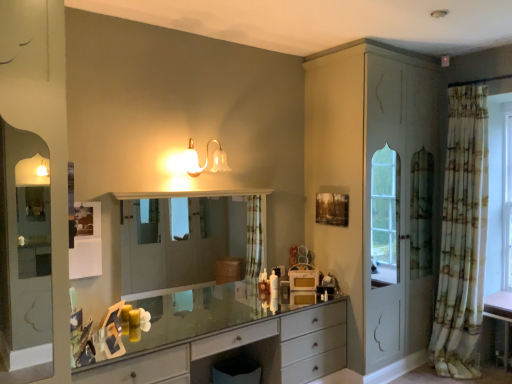
Question: Does printed fabric curtain at right come behind matte gray chest of drawers at center?

Choices:
 (A) no
 (B) yes

Answer: (B)

Question: From a real-world perspective, is printed fabric curtain at right on matte gray chest of drawers at center?

Choices:
 (A) yes
 (B) no

Answer: (A)

Question: Is printed fabric curtain at right to the right of matte gray chest of drawers at center from the viewer's perspective?

Choices:
 (A) no
 (B) yes

Answer: (B)

Question: Could you tell me if printed fabric curtain at right is facing matte gray chest of drawers at center?

Choices:
 (A) yes
 (B) no

Answer: (B)

Question: Can you confirm if printed fabric curtain at right is thinner than matte gray chest of drawers at center?

Choices:
 (A) yes
 (B) no

Answer: (A)

Question: Looking at their shapes, would you say translucent glass sconce at upper center is wider or thinner than clear glass mirror at center?

Choices:
 (A) thin
 (B) wide

Answer: (B)

Question: In the image, is translucent glass sconce at upper center on the left side or the right side of clear glass mirror at center?

Choices:
 (A) right
 (B) left

Answer: (B)

Question: Is translucent glass sconce at upper center spatially inside clear glass mirror at center, or outside of it?

Choices:
 (A) inside
 (B) outside

Answer: (B)

Question: From the image's perspective, is translucent glass sconce at upper center positioned above or below clear glass mirror at center?

Choices:
 (A) above
 (B) below

Answer: (A)

Question: Do you think matte gray chest of drawers at center is within translucent glass sconce at upper center, or outside of it?

Choices:
 (A) inside
 (B) outside

Answer: (B)

Question: Considering the positions of point (219, 334) and point (212, 168), is point (219, 334) closer or farther from the camera than point (212, 168)?

Choices:
 (A) closer
 (B) farther

Answer: (A)

Question: From a real-world perspective, is matte gray chest of drawers at center above or below translucent glass sconce at upper center?

Choices:
 (A) below
 (B) above

Answer: (A)

Question: Is matte gray chest of drawers at center wider or thinner than translucent glass sconce at upper center?

Choices:
 (A) thin
 (B) wide

Answer: (B)

Question: Do you think clear glass mirror at center is within translucent glass sconce at upper center, or outside of it?

Choices:
 (A) inside
 (B) outside

Answer: (B)

Question: Considering the relative positions of clear glass mirror at center and translucent glass sconce at upper center in the image provided, is clear glass mirror at center to the left or to the right of translucent glass sconce at upper center?

Choices:
 (A) left
 (B) right

Answer: (B)